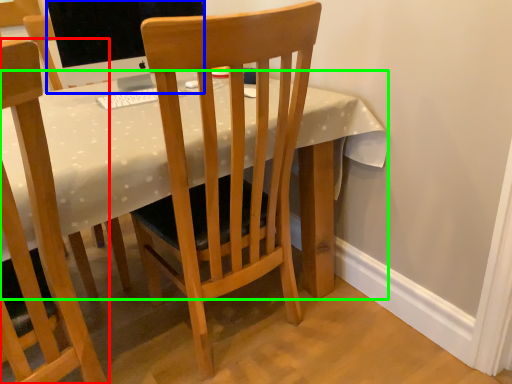
Question: Which object is positioned farthest from chair (highlighted by a red box)? Select from television (highlighted by a blue box) and desk (highlighted by a green box).

Choices:
 (A) television
 (B) desk

Answer: (A)